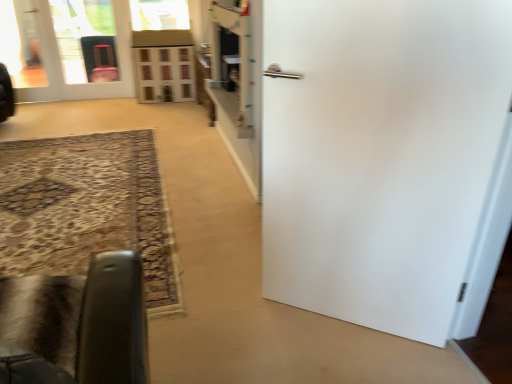
Question: Is transparent glass door at upper left smaller than wooden dollhouse at center?

Choices:
 (A) yes
 (B) no

Answer: (A)

Question: Would you say transparent glass door at upper left is a long distance from wooden dollhouse at center?

Choices:
 (A) no
 (B) yes

Answer: (A)

Question: Considering the relative sizes of transparent glass door at upper left and wooden dollhouse at center in the image provided, is transparent glass door at upper left thinner than wooden dollhouse at center?

Choices:
 (A) yes
 (B) no

Answer: (A)

Question: From a real-world perspective, does transparent glass door at upper left sit lower than wooden dollhouse at center?

Choices:
 (A) yes
 (B) no

Answer: (B)

Question: Does transparent glass door at upper left have a greater height compared to wooden dollhouse at center?

Choices:
 (A) yes
 (B) no

Answer: (A)

Question: Is transparent glass door at upper left in contact with wooden dollhouse at center?

Choices:
 (A) no
 (B) yes

Answer: (A)

Question: From a real-world perspective, is velvet black chair at lower left physically below wooden dollhouse at center?

Choices:
 (A) yes
 (B) no

Answer: (B)

Question: Can you confirm if velvet black chair at lower left is wider than wooden dollhouse at center?

Choices:
 (A) no
 (B) yes

Answer: (B)

Question: From a real-world perspective, is velvet black chair at lower left over wooden dollhouse at center?

Choices:
 (A) no
 (B) yes

Answer: (B)

Question: Can you confirm if velvet black chair at lower left is positioned to the left of wooden dollhouse at center?

Choices:
 (A) yes
 (B) no

Answer: (B)

Question: Does velvet black chair at lower left have a greater height compared to wooden dollhouse at center?

Choices:
 (A) yes
 (B) no

Answer: (B)

Question: Considering the relative sizes of velvet black chair at lower left and wooden dollhouse at center in the image provided, is velvet black chair at lower left shorter than wooden dollhouse at center?

Choices:
 (A) yes
 (B) no

Answer: (A)

Question: From a real-world perspective, is matte white door at upper left, the 2th door when ordered from front to back, on velvet black chair at lower left?

Choices:
 (A) yes
 (B) no

Answer: (A)